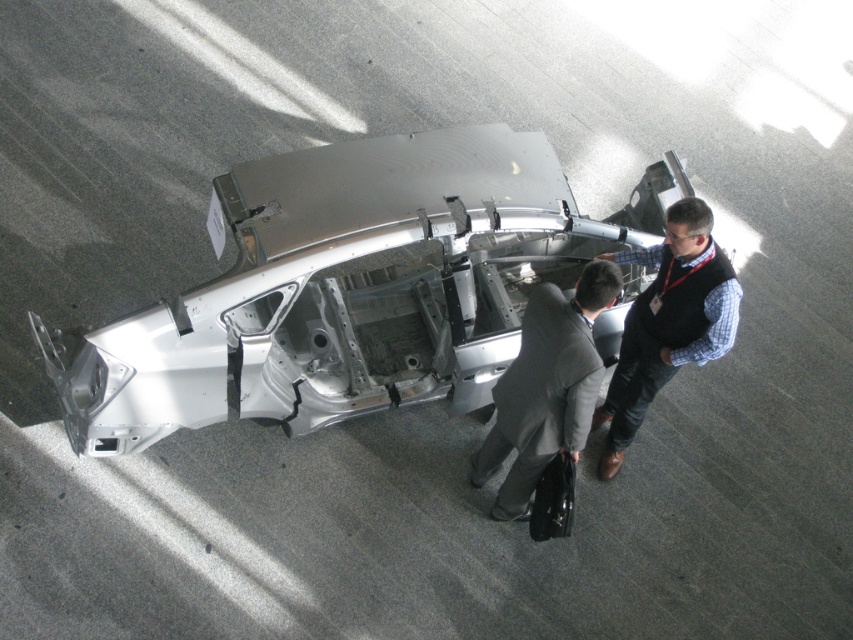
Question: Does silver metallic car at center appear under dark gray suit at center?

Choices:
 (A) no
 (B) yes

Answer: (A)

Question: Which object appears farthest from the camera in this image?

Choices:
 (A) matte black vest at center
 (B) silver metallic car at center
 (C) dark gray suit at center

Answer: (B)

Question: Estimate the real-world distances between objects in this image. Which object is closer to the silver metallic car at center?

Choices:
 (A) matte black vest at center
 (B) dark gray suit at center

Answer: (B)

Question: Among these points, which one is farthest from the camera?

Choices:
 (A) (537, 298)
 (B) (457, 253)

Answer: (B)

Question: From the image, what is the correct spatial relationship of dark gray suit at center in relation to matte black vest at center?

Choices:
 (A) left
 (B) right

Answer: (A)

Question: Is dark gray suit at center to the left of matte black vest at center from the viewer's perspective?

Choices:
 (A) yes
 (B) no

Answer: (A)